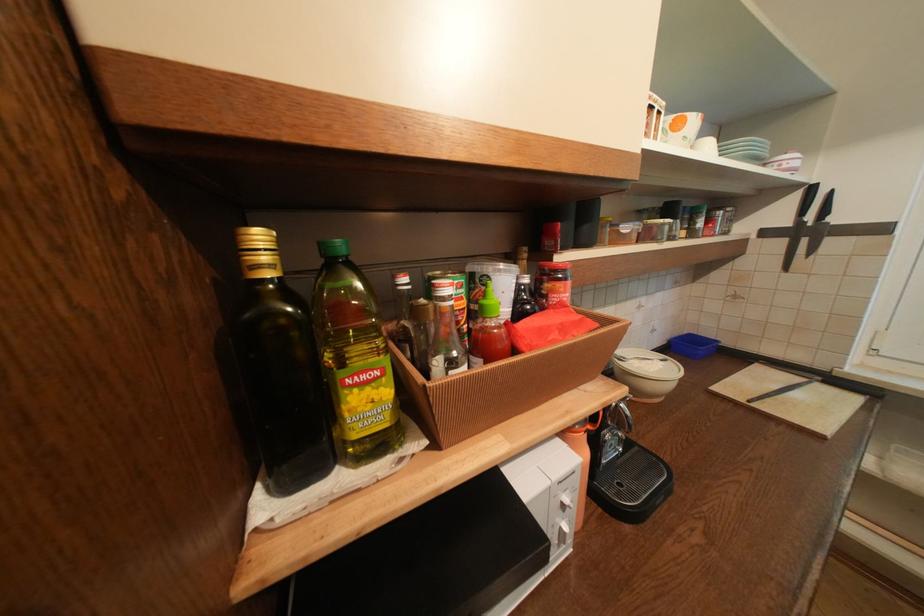
What do you see at coordinates (624, 435) in the screenshot? I see `a metal machine lever` at bounding box center [624, 435].